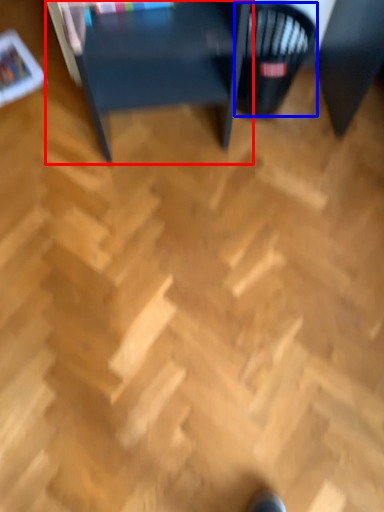
Question: Which of the following is the closest to the observer, table (highlighted by a red box) or basket (highlighted by a blue box)?

Choices:
 (A) table
 (B) basket

Answer: (A)